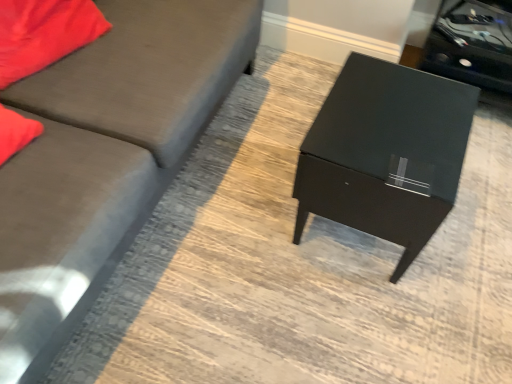
Question: Would you say matte gray couch at left is part of matte black table at center's contents?

Choices:
 (A) no
 (B) yes

Answer: (A)

Question: Is matte black table at center behind matte gray couch at left?

Choices:
 (A) no
 (B) yes

Answer: (B)

Question: Considering the relative sizes of matte black table at center and matte gray couch at left in the image provided, is matte black table at center bigger than matte gray couch at left?

Choices:
 (A) yes
 (B) no

Answer: (B)

Question: Are matte black table at center and matte gray couch at left making contact?

Choices:
 (A) no
 (B) yes

Answer: (A)

Question: Does matte black table at center have a greater height compared to matte gray couch at left?

Choices:
 (A) yes
 (B) no

Answer: (B)

Question: Considering the positions of point [x=41, y=14] and point [x=161, y=6], is point [x=41, y=14] closer or farther from the camera than point [x=161, y=6]?

Choices:
 (A) farther
 (B) closer

Answer: (B)

Question: Considering the positions of matte red pillow at upper left and matte gray couch at left in the image, is matte red pillow at upper left taller or shorter than matte gray couch at left?

Choices:
 (A) short
 (B) tall

Answer: (A)

Question: From a real-world perspective, is matte red pillow at upper left positioned above or below matte gray couch at left?

Choices:
 (A) above
 (B) below

Answer: (A)

Question: Is matte red pillow at upper left to the left or to the right of matte gray couch at left in the image?

Choices:
 (A) right
 (B) left

Answer: (B)

Question: From a real-world perspective, is matte gray couch at left physically located above or below matte red pillow at upper left?

Choices:
 (A) below
 (B) above

Answer: (A)

Question: From the image's perspective, is matte gray couch at left located above or below matte red pillow at upper left?

Choices:
 (A) below
 (B) above

Answer: (A)

Question: Choose the correct answer: Is matte gray couch at left inside matte red pillow at upper left or outside it?

Choices:
 (A) outside
 (B) inside

Answer: (A)

Question: Considering their positions, is matte gray couch at left located in front of or behind matte red pillow at upper left?

Choices:
 (A) front
 (B) behind

Answer: (A)

Question: From the image's perspective, is black glossy side table at upper right located above or below matte black table at center?

Choices:
 (A) below
 (B) above

Answer: (B)

Question: Is black glossy side table at upper right taller or shorter than matte black table at center?

Choices:
 (A) short
 (B) tall

Answer: (A)